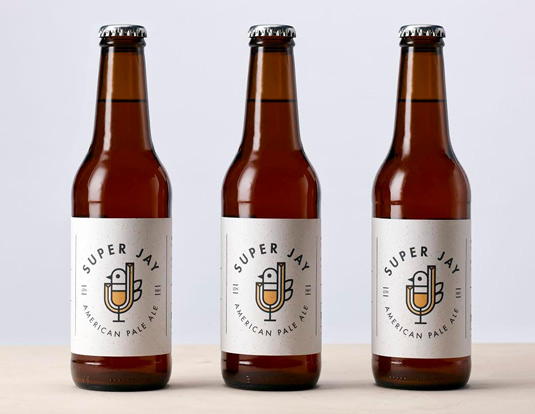
What are the coordinates of `beer bottles` in the screenshot? It's located at (118, 185), (282, 193), (395, 193).